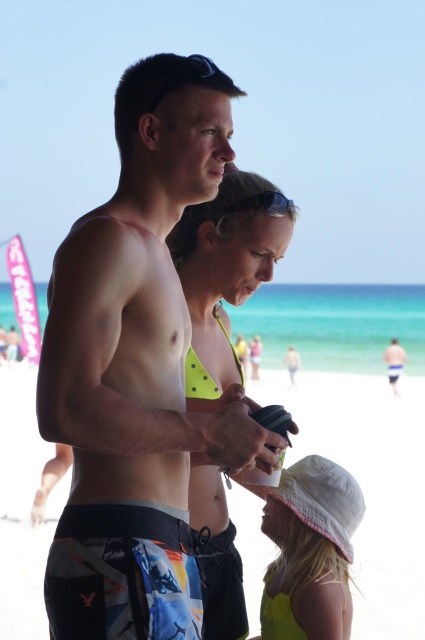
Question: Considering the relative positions of multicolored board shorts at center and white cotton hat at lower right in the image provided, where is multicolored board shorts at center located with respect to white cotton hat at lower right?

Choices:
 (A) right
 (B) left

Answer: (B)

Question: From the image, what is the correct spatial relationship of neon green bikini top at center in relation to white cotton hat at lower right?

Choices:
 (A) above
 (B) below

Answer: (A)

Question: Which point is closer to the camera?

Choices:
 (A) white fabric hat at lower center
 (B) multicolored board shorts at center

Answer: (B)

Question: Is neon green bikini top at center below white board shorts at center?

Choices:
 (A) no
 (B) yes

Answer: (A)

Question: Estimate the real-world distances between objects in this image. Which object is farther from the multicolored board shorts at center?

Choices:
 (A) neon green bikini top at center
 (B) white fabric hat at lower center

Answer: (B)

Question: Which point is farther to the camera?

Choices:
 (A) (340, 516)
 (B) (110, 400)

Answer: (A)